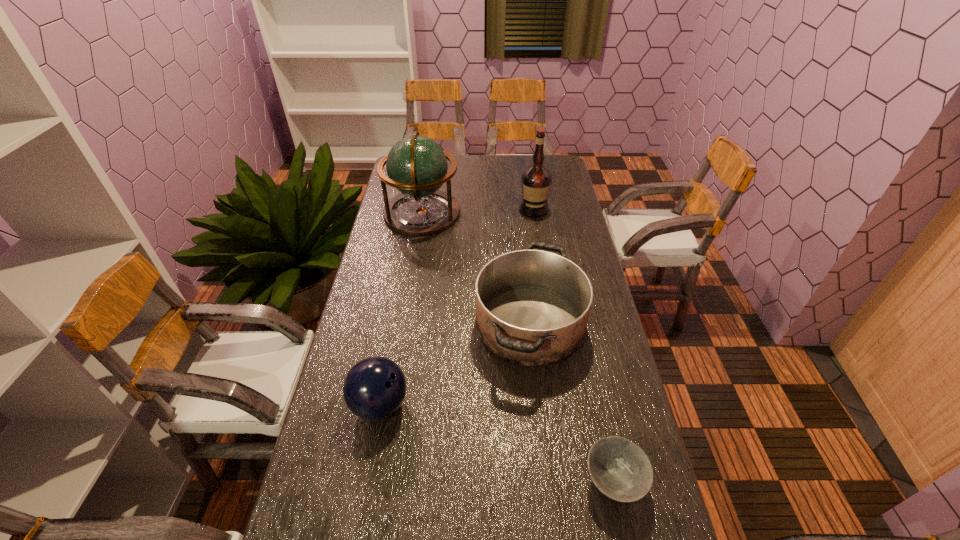
Identify the location of liquor. This screenshot has height=540, width=960. (536, 179).

The height and width of the screenshot is (540, 960). I want to click on globe, so click(x=416, y=165).

The image size is (960, 540). I want to click on saucepan, so click(532, 306).

Where is `bowling ball`? This screenshot has height=540, width=960. bowling ball is located at coordinates (374, 388).

The height and width of the screenshot is (540, 960). Find the location of `the nearest object`. the nearest object is located at coordinates (620, 469).

Where is `the shortest object`? The height and width of the screenshot is (540, 960). the shortest object is located at coordinates (620, 469).

You are a GUI agent. You are given a task and a screenshot of the screen. Output one action in this format:
    pyautogui.click(x=<x>, y=<y>)
    Task: Click on the vacant space located on the surface of the liquor
    The width and height of the screenshot is (960, 540).
    Given the screenshot: What is the action you would take?
    pyautogui.click(x=540, y=250)

Where is `vacant space located 0.360m on the front-facing side of the globe`? The height and width of the screenshot is (540, 960). vacant space located 0.360m on the front-facing side of the globe is located at coordinates (546, 213).

I want to click on free space located 0.180m on the front of the saucepan, so click(543, 447).

Where is `blank space located on the surface of the bowling ball near the finger holes`? Image resolution: width=960 pixels, height=540 pixels. blank space located on the surface of the bowling ball near the finger holes is located at coordinates (472, 404).